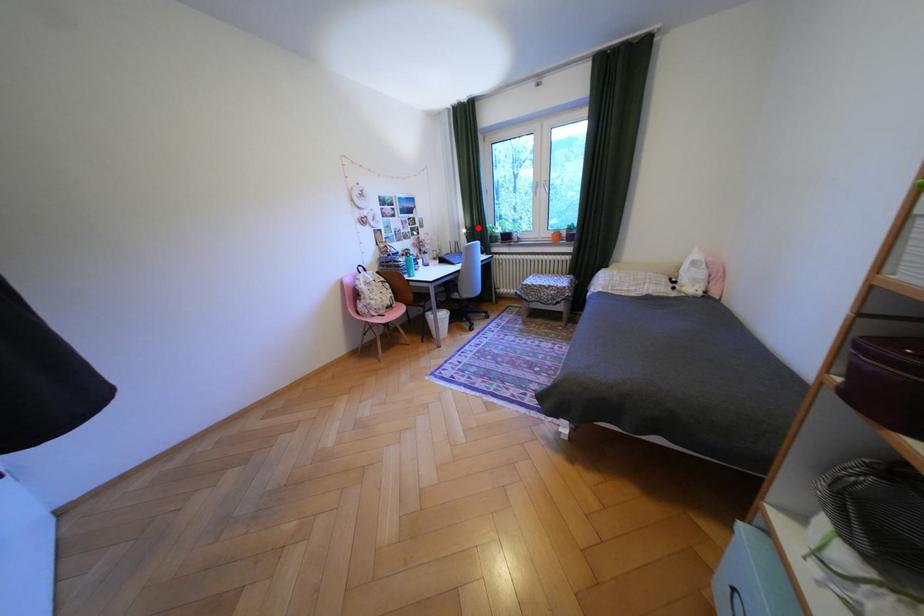
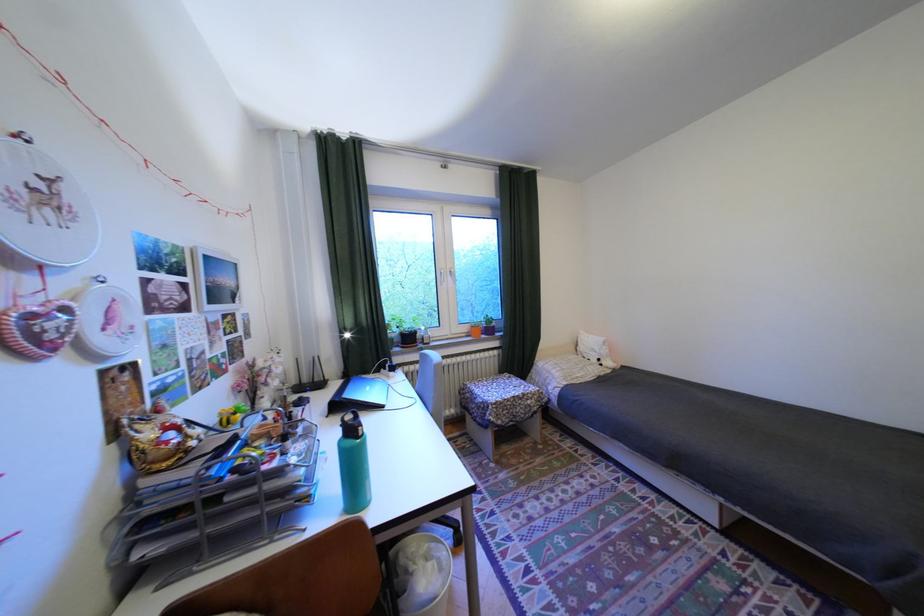
Question: I am providing you with two images of the same scene from different viewpoints. A red point is shown in image1. For the corresponding object point in image2, is it positioned nearer or farther from the camera?

Choices:
 (A) Nearer
 (B) Farther

Answer: (B)